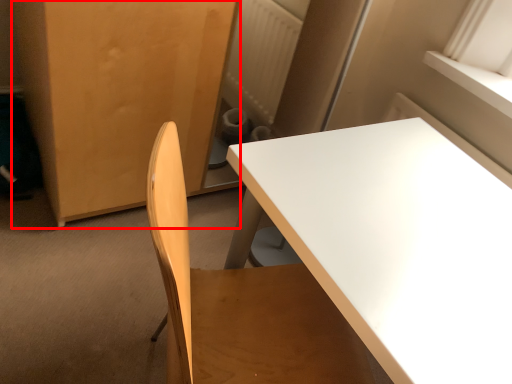
Question: Where is armoire (annotated by the red box) located in relation to table in the image?

Choices:
 (A) right
 (B) left

Answer: (B)